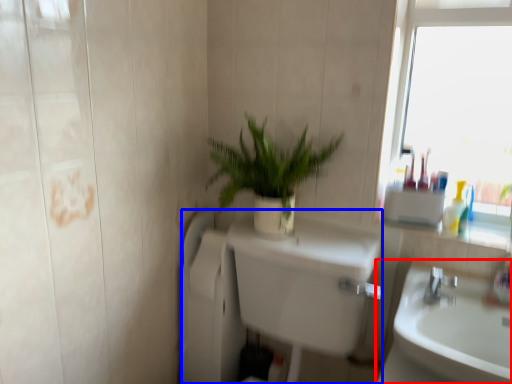
Question: Which object appears farthest to the camera in this image, sink (highlighted by a red box) or bath (highlighted by a blue box)?

Choices:
 (A) sink
 (B) bath

Answer: (A)